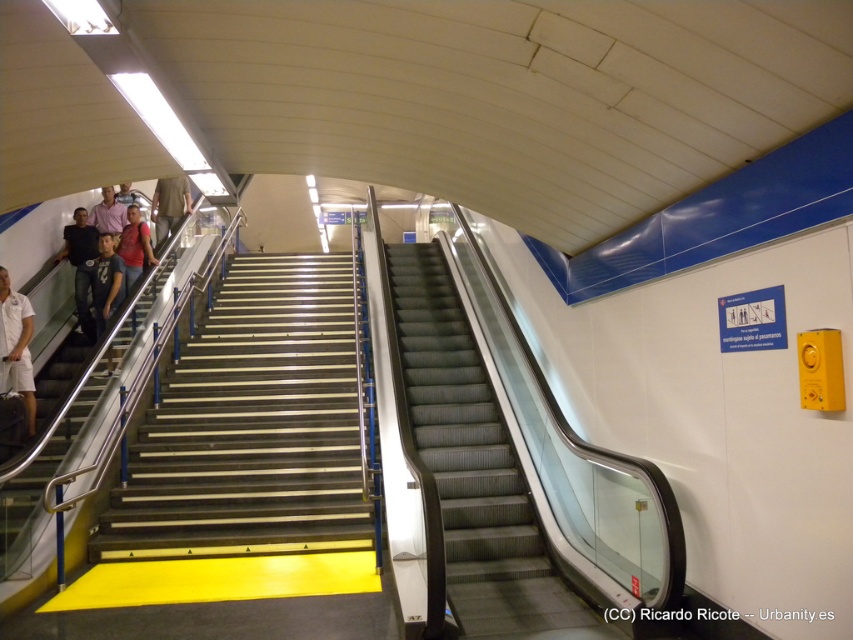
Does dark blue jeans at left come behind matte brown jacket at upper left?

No, it is in front of matte brown jacket at upper left.

Which is behind, point (83, 291) or point (172, 228)?

Positioned behind is point (172, 228).

The height and width of the screenshot is (640, 853). I want to click on dark blue jeans at left, so click(80, 266).

Is metallic stairs at center thinner than white cotton shirt at left?

No, metallic stairs at center is not thinner than white cotton shirt at left.

Which is above, metallic stairs at center or white cotton shirt at left?

white cotton shirt at left is above.

The image size is (853, 640). What do you see at coordinates (251, 426) in the screenshot?
I see `metallic stairs at center` at bounding box center [251, 426].

Find the location of a particular element. metallic stairs at center is located at coordinates (251, 426).

Does point (28, 419) lie in front of point (84, 326)?

Yes.

Does white cotton shirt at left come behind dark blue jeans at left?

That is False.

Identify the location of white cotton shirt at left. The height and width of the screenshot is (640, 853). click(16, 344).

Identify the location of white cotton shirt at left. (16, 344).